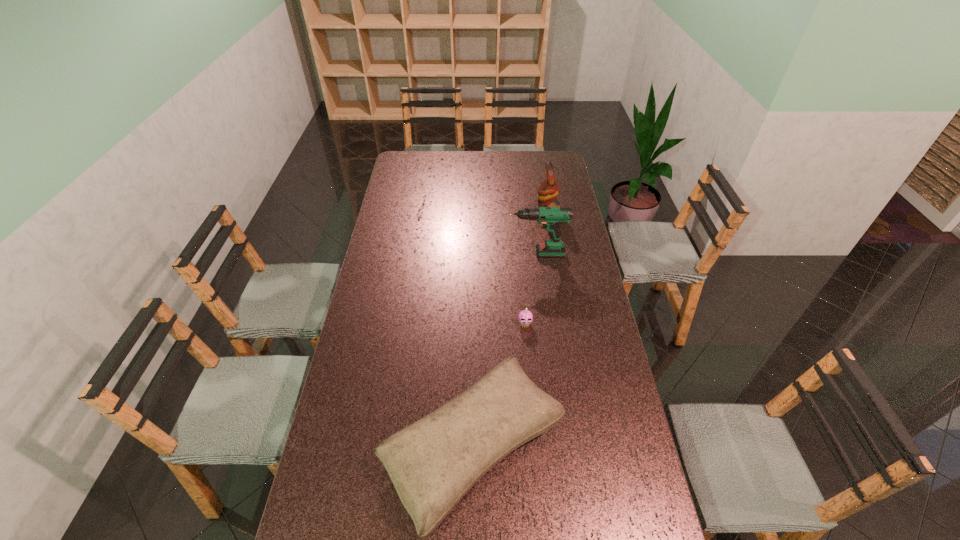
Locate an element on the screen. This screenshot has height=540, width=960. vacant space located 0.380m on the face of the cupcake is located at coordinates [535, 429].

Identify the location of parrot located at the right edge. The height and width of the screenshot is (540, 960). (549, 189).

Where is `drill positioned at the right edge`? The width and height of the screenshot is (960, 540). drill positioned at the right edge is located at coordinates (551, 218).

This screenshot has height=540, width=960. In order to click on vacant space at the far edge of the desktop in this screenshot , I will do `click(519, 161)`.

Locate an element on the screen. The image size is (960, 540). free space at the left edge of the desktop is located at coordinates (389, 215).

Identify the location of vacant area at the right edge. The width and height of the screenshot is (960, 540). (600, 328).

Where is `vacant space at the far left corner of the desktop`? The width and height of the screenshot is (960, 540). vacant space at the far left corner of the desktop is located at coordinates (425, 159).

Where is `free region at the far right corner of the desktop`? Image resolution: width=960 pixels, height=540 pixels. free region at the far right corner of the desktop is located at coordinates (545, 153).

The image size is (960, 540). Find the location of `empty space that is in between the farthest object and the shortest object`. empty space that is in between the farthest object and the shortest object is located at coordinates (537, 267).

Find the location of `vacant space that's between the farthest object and the second nearest object`. vacant space that's between the farthest object and the second nearest object is located at coordinates (x=537, y=267).